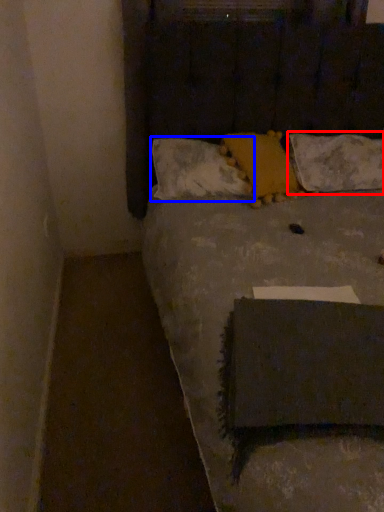
Question: Among these objects, which one is nearest to the camera, pillow (highlighted by a red box) or pillow (highlighted by a blue box)?

Choices:
 (A) pillow
 (B) pillow

Answer: (B)